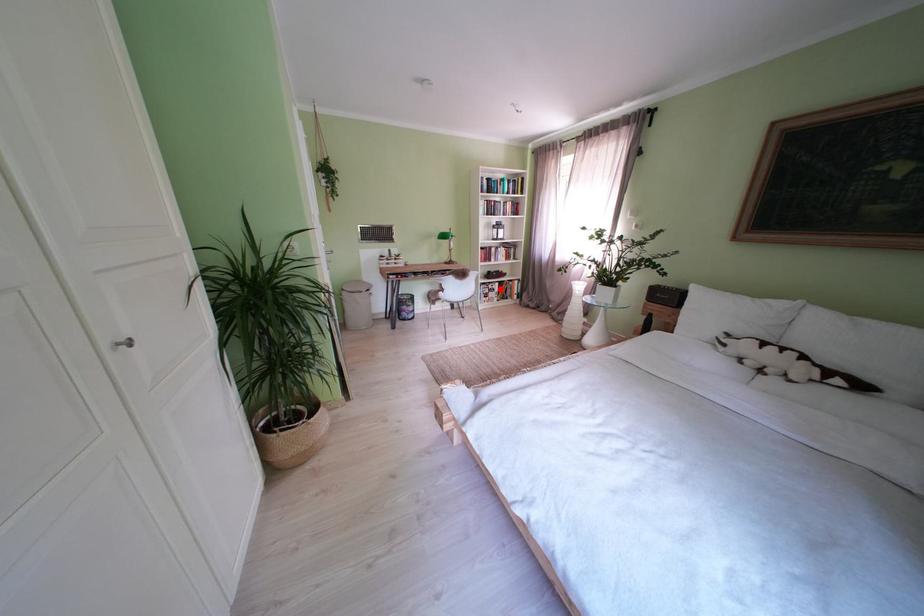
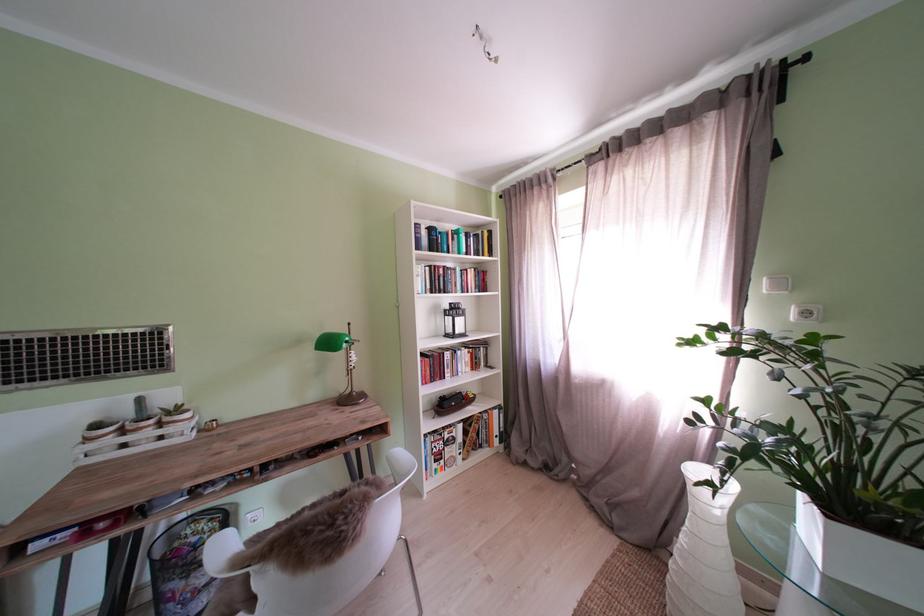
Question: I am providing you with two images of the same scene from different viewpoints. Image1 has a red point marked. In image2, the corresponding 3D location appears at what relative position? Reply with the corresponding letter.

Choices:
 (A) Closer
 (B) Farther

Answer: (B)